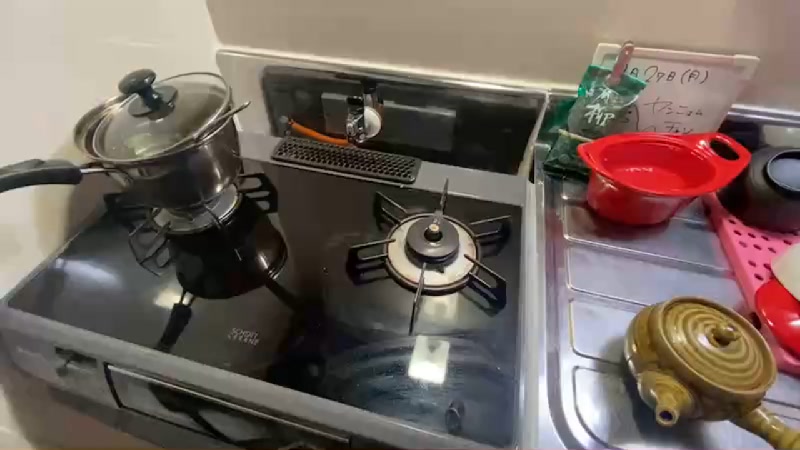
Locate an element on the screen. This screenshot has height=450, width=800. red baking dish on stainless steel counter is located at coordinates (634, 209).